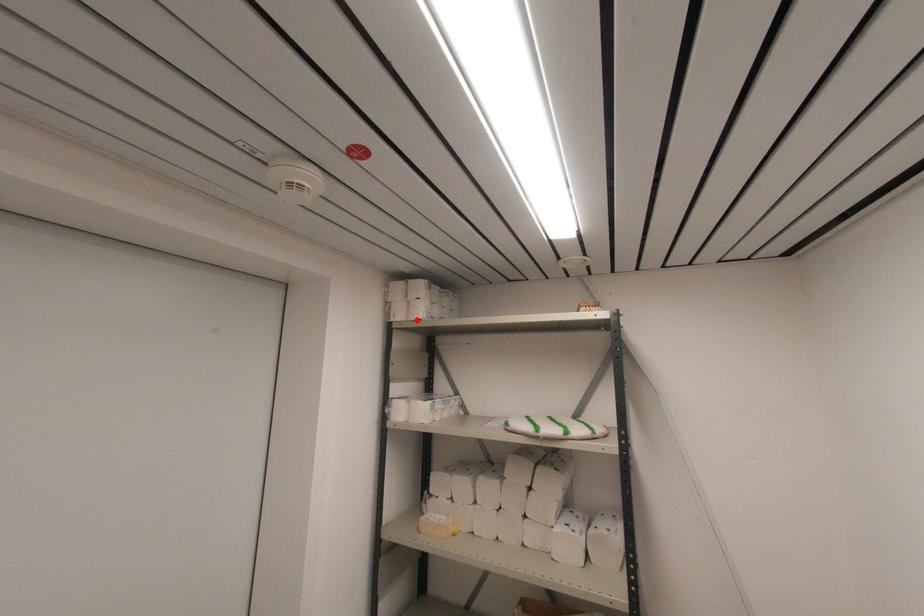
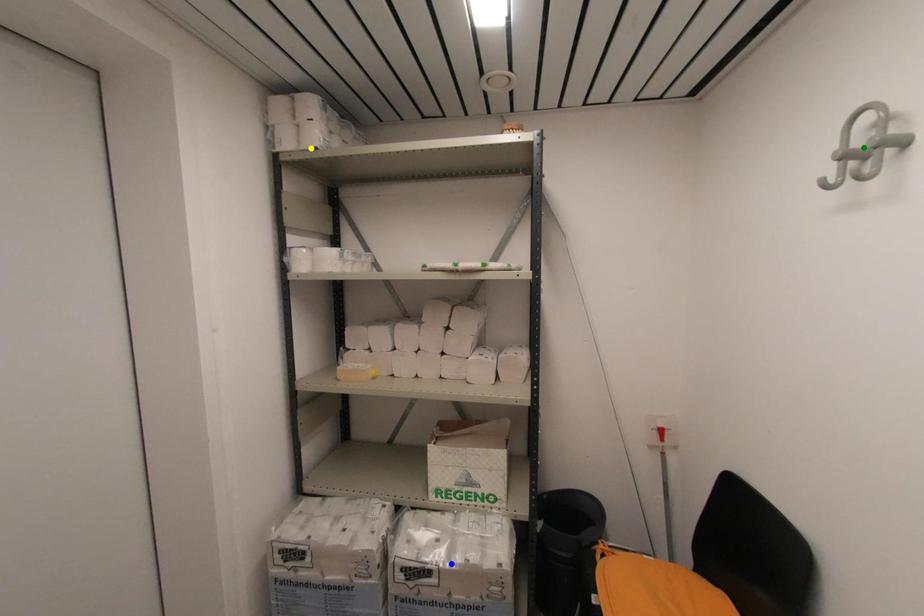
Question: I am providing you with two images of the same scene from different viewpoints. A red point is marked on the first image. You are given multiple points on the second image. Which spot in image 2 lines up with the point in image 1?

Choices:
 (A) green point
 (B) yellow point
 (C) blue point

Answer: (B)